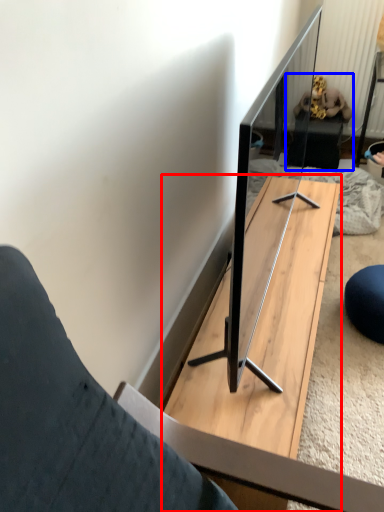
Question: Among these objects, which one is nearest to the camera, table (highlighted by a red box) or person (highlighted by a blue box)?

Choices:
 (A) table
 (B) person

Answer: (A)